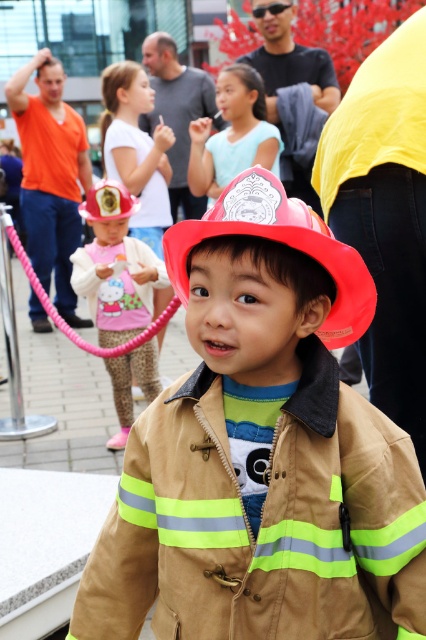
Who is taller, matte plastic fireman at center or matte plastic fire helmet at center?

matte plastic fireman at center is taller.

From the picture: Can you confirm if matte plastic fireman at center is taller than matte plastic fire helmet at center?

Yes.

Who is more distant from viewer, (x=296, y=68) or (x=111, y=204)?

Positioned behind is point (x=296, y=68).

Where is `matte plastic fireman at center`? The width and height of the screenshot is (426, 640). matte plastic fireman at center is located at coordinates (290, 60).

Does matte red helmet at center have a larger size compared to matte plastic fire helmet at center?

Indeed, matte red helmet at center has a larger size compared to matte plastic fire helmet at center.

Between point (247, 348) and point (92, 193), which one is positioned in front?

Point (247, 348) is more forward.

Image resolution: width=426 pixels, height=640 pixels. In order to click on matte red helmet at center in this screenshot , I will do `click(261, 452)`.

Is shiny red helmet at center thinner than matte plastic fireman at center?

Indeed, shiny red helmet at center has a lesser width compared to matte plastic fireman at center.

Is shiny red helmet at center closer to camera compared to matte plastic fireman at center?

Yes.

Who is more forward, [268,177] or [328,67]?

Point [268,177]

In order to click on shiny red helmet at center in this screenshot , I will do `click(281, 243)`.